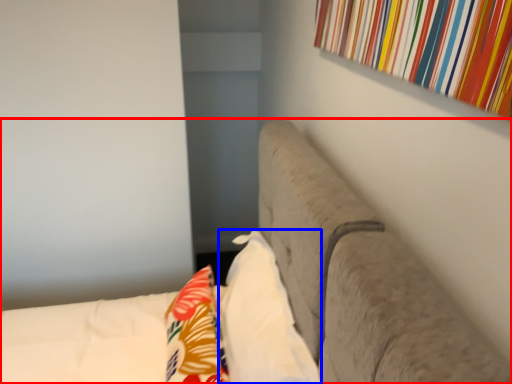
Question: Which object is further to the camera taking this photo, furniture (highlighted by a red box) or pillow (highlighted by a blue box)?

Choices:
 (A) furniture
 (B) pillow

Answer: (B)